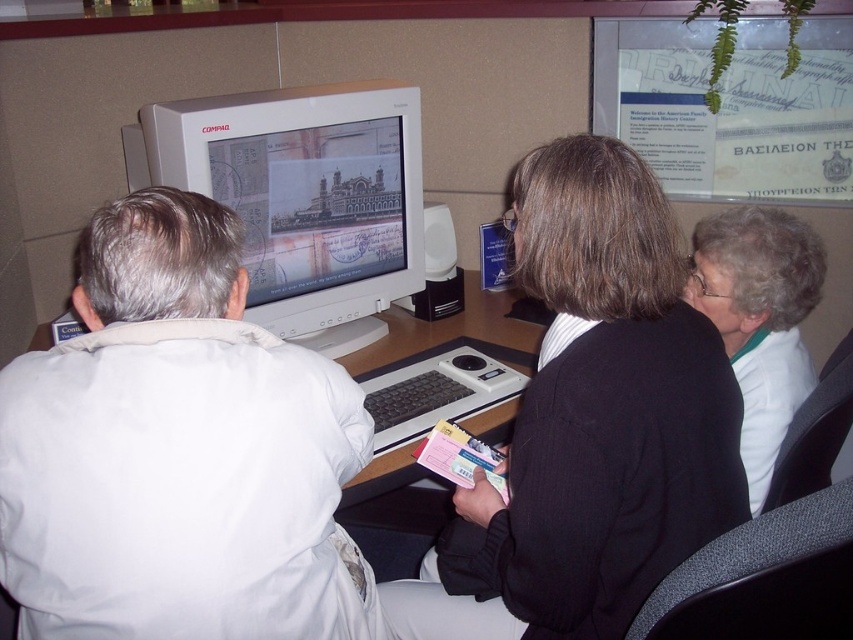
You are a photographer taking a picture of the scene. The white matte jacket at left and the white matte computer monitor at center are both in your frame. Which object is located to the left of the other?

The white matte jacket at left is positioned on the left side of the white matte computer monitor at center.